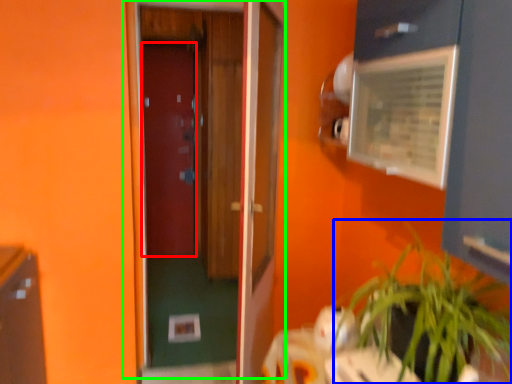
Question: Based on their relative distances, which object is nearer to door (highlighted by a red box)? Choose from houseplant (highlighted by a blue box) and door (highlighted by a green box).

Choices:
 (A) houseplant
 (B) door

Answer: (B)